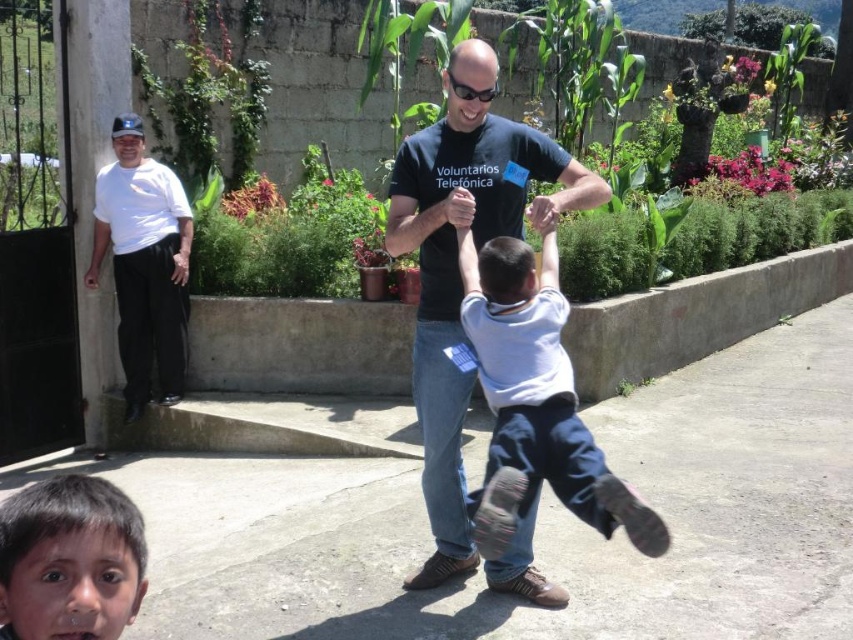
You are a photographer trying to capture a candid shot of the scene. You notice the white cotton shirt at center and the dark brown hair at lower left. Which object is positioned higher in the image?

The white cotton shirt at center is positioned higher than the dark brown hair at lower left.